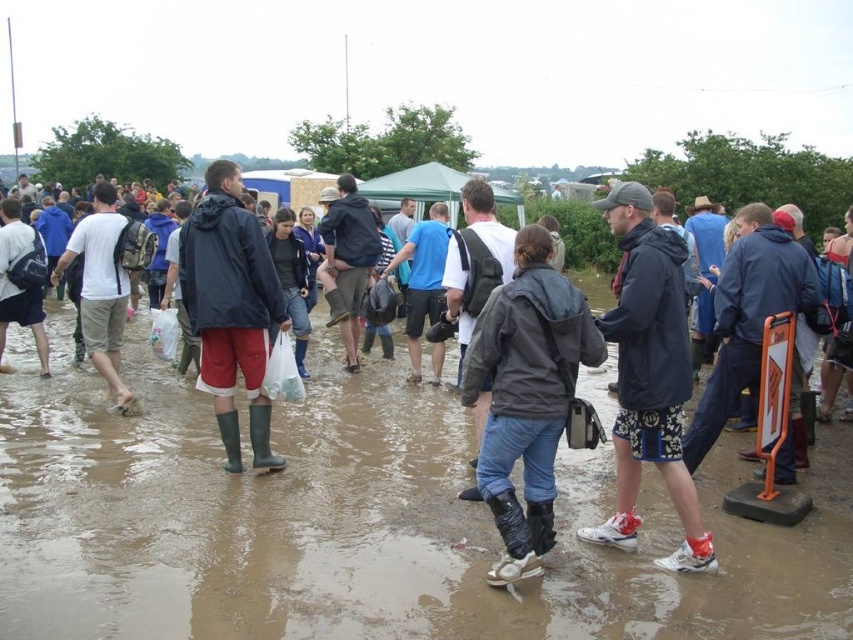
Based on the photo, can you confirm if brown muddy ground at center is positioned to the left of matte black jacket at left?

No, brown muddy ground at center is not to the left of matte black jacket at left.

Can you confirm if brown muddy ground at center is bigger than matte black jacket at left?

Actually, brown muddy ground at center might be smaller than matte black jacket at left.

Does point (796, 532) lie in front of point (21, 241)?

Yes, it is in front of point (21, 241).

The width and height of the screenshot is (853, 640). In order to click on brown muddy ground at center in this screenshot , I will do `click(347, 528)`.

Is point (653, 253) more distant than point (16, 259)?

No, it is in front of (16, 259).

Which of these two, dark blue waterproof jacket at center or matte black jacket at left, stands taller?

dark blue waterproof jacket at center is taller.

The height and width of the screenshot is (640, 853). Find the location of `dark blue waterproof jacket at center`. dark blue waterproof jacket at center is located at coordinates (648, 376).

Which is in front, point (194, 317) or point (0, 292)?

Positioned in front is point (194, 317).

Where is `rubber boots at center`? rubber boots at center is located at coordinates (231, 308).

This screenshot has height=640, width=853. I want to click on rubber boots at center, so click(231, 308).